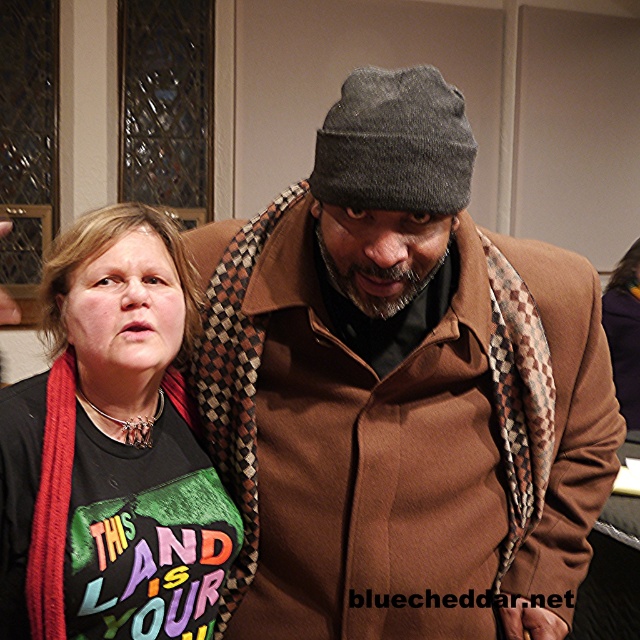
Question: Which point appears closest to the camera in this image?

Choices:
 (A) (449, 116)
 (B) (141, 531)

Answer: (A)

Question: Observing the image, what is the correct spatial positioning of matte black t-shirt at center in reference to gray woolen beanie at center?

Choices:
 (A) left
 (B) right

Answer: (A)

Question: Considering the relative positions of matte black t-shirt at center and gray woolen beanie at center in the image provided, where is matte black t-shirt at center located with respect to gray woolen beanie at center?

Choices:
 (A) below
 (B) above

Answer: (A)

Question: Is matte black t-shirt at center behind gray woolen beanie at center?

Choices:
 (A) yes
 (B) no

Answer: (A)